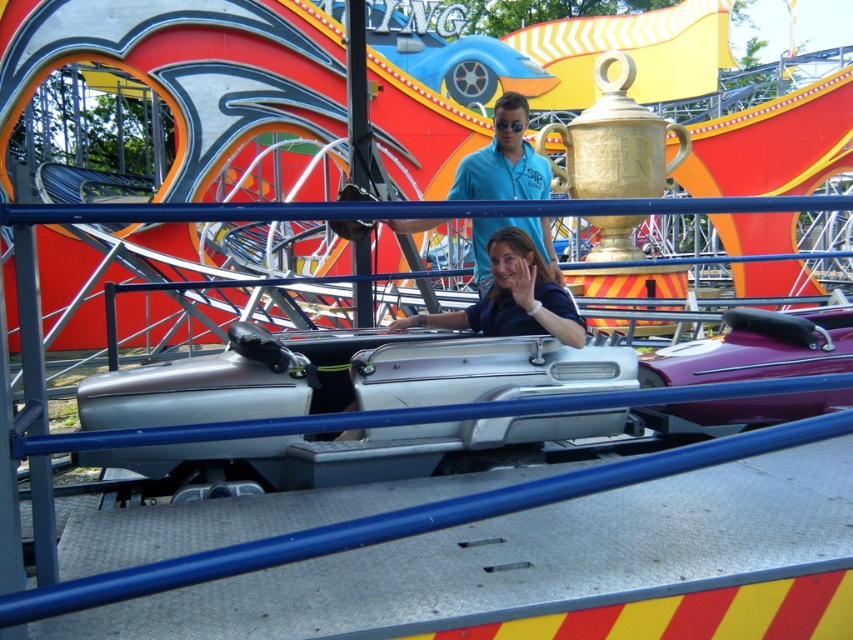
You are standing in front of the silver car and want to reach the control lever. The control lever is at point (437, 324). There is an obstacle at point (489, 161). Can you safely walk around the obstacle to reach the control lever?

Point (489, 161) is further to the camera than point (437, 324), so the obstacle is closer to you. You can walk around it to reach the control lever safely.

You are a park visitor trying to decide which staff member to approach for assistance. You see two staff members wearing shirts labeled as blue cotton shirt at center and blue matte shirt at center. Which shirt is wider?

The blue cotton shirt at center might be wider than blue matte shirt at center.